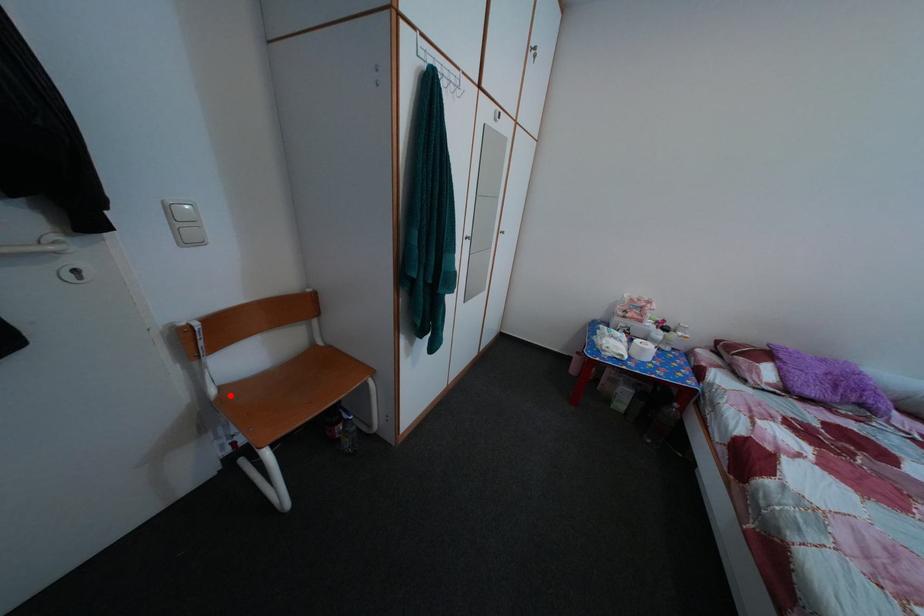
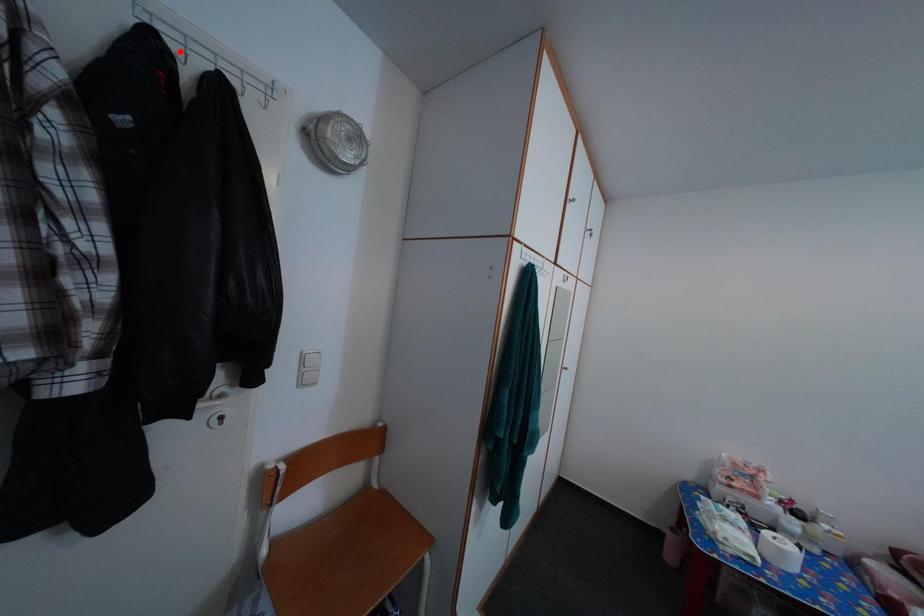
I am providing you with two images of the same scene from different viewpoints. A red point is marked on the first image and another point is marked on the second image. Is the red point in image1 aligned with the point shown in image2?

No